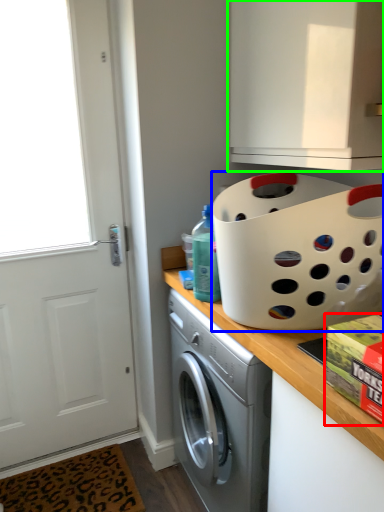
Question: Which is farther away from box (highlighted by a red box)? basket (highlighted by a blue box) or cabinetry (highlighted by a green box)?

Choices:
 (A) basket
 (B) cabinetry

Answer: (B)